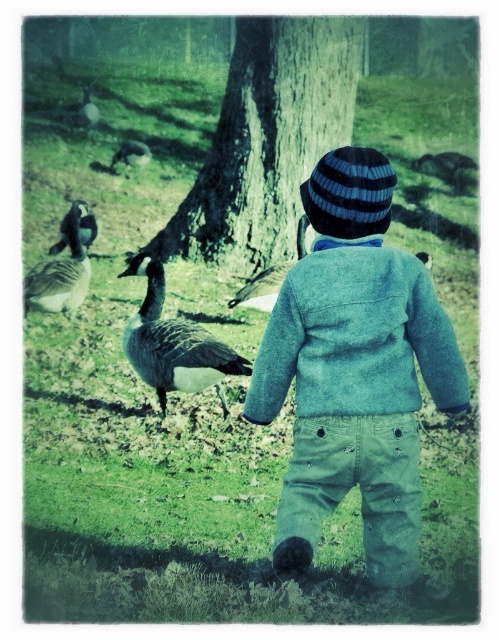
Based on the photo, you are a birdwatcher observing the scene. You see the gray feathered goose at left and the gray feathered duck at center. Which one is located to the left of the other?

The gray feathered goose at left is positioned on the left side of the gray feathered duck at center.